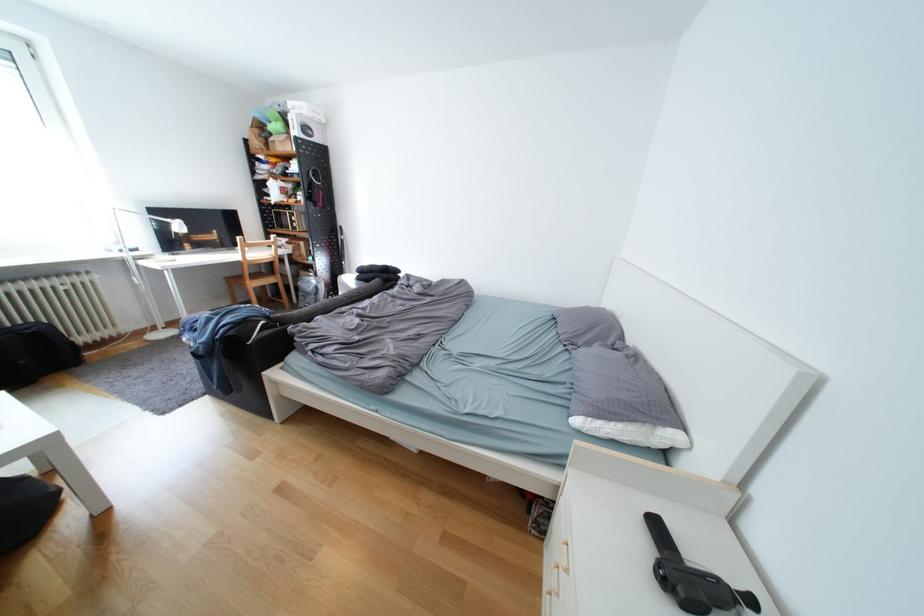
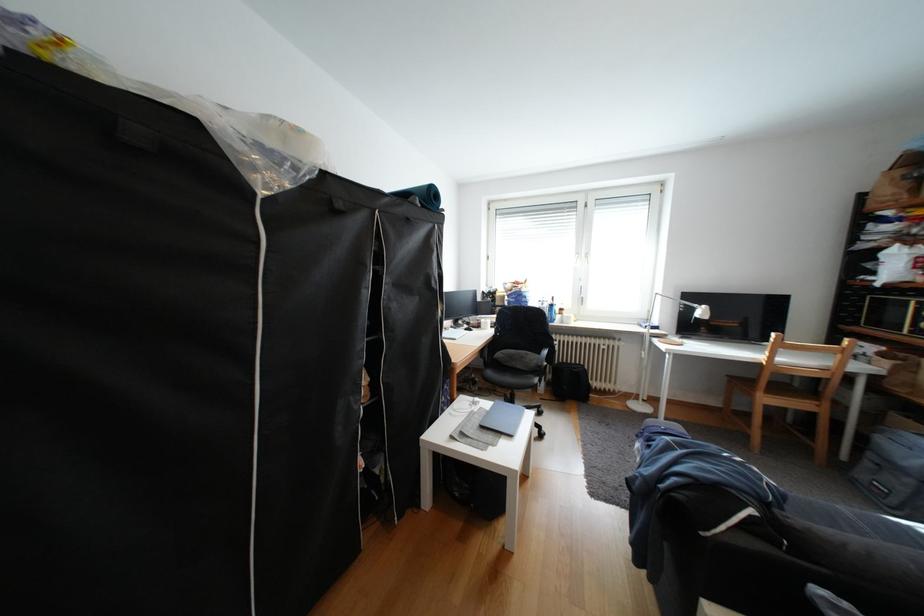
Find the pixel in the second image that matches (155,262) in the first image.

(667, 341)